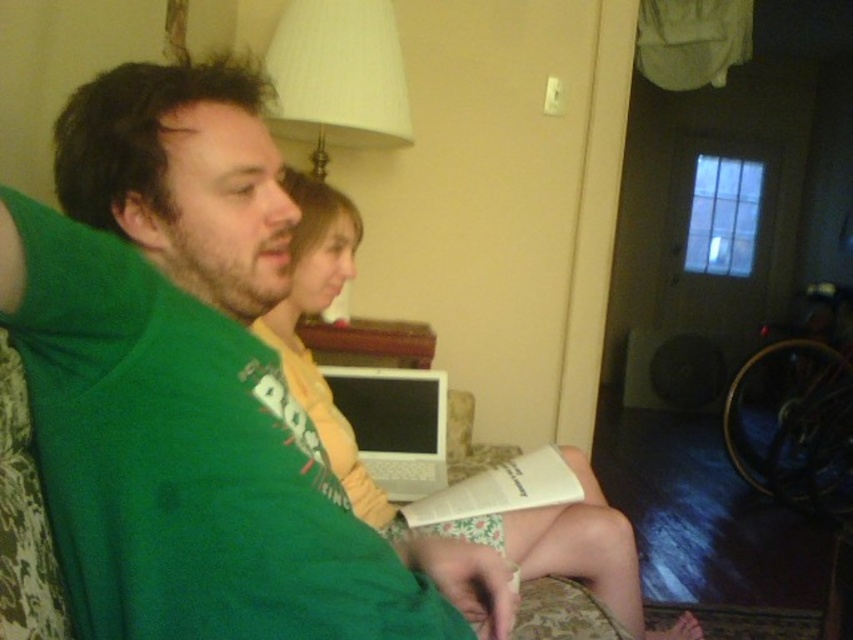
You are standing in the living room and want to find the yellow knit sweater at center. According to the coordinates provided, where should you look?

The yellow knit sweater at center is located at coordinates point [314,314].

You are a delivery person who needs to place a small package on the table between the yellow knit sweater at center and the white plastic laptop at center. Can you fit the package there without moving either item?

The yellow knit sweater at center is taller than the white plastic laptop at center, so there might be space between them to place the package, but since both are at the center, their exact positioning isn

You are standing in the room and want to place a small decoration exactly at the point marked by the coordinates point (314, 314). Which object is currently occupying that location?

The yellow knit sweater at center is located at point (314, 314), so that is the object occupying that location.